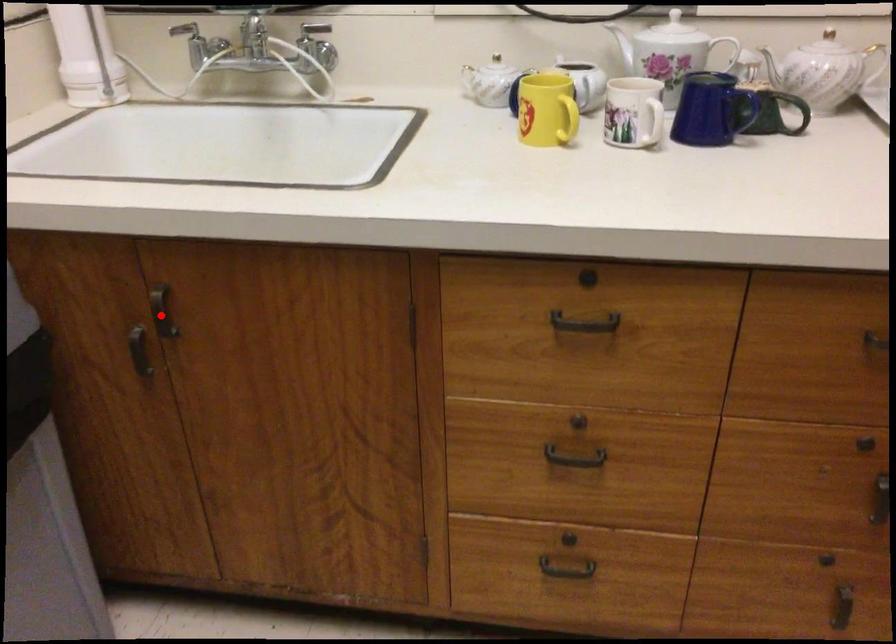
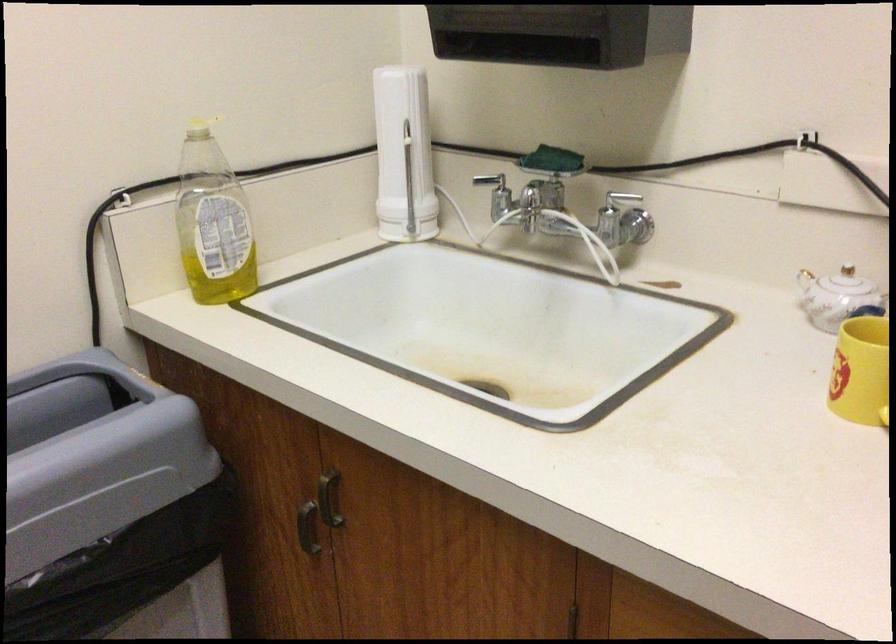
Where in the second image is the point corresponding to the highlighted location from the first image?

(328, 498)